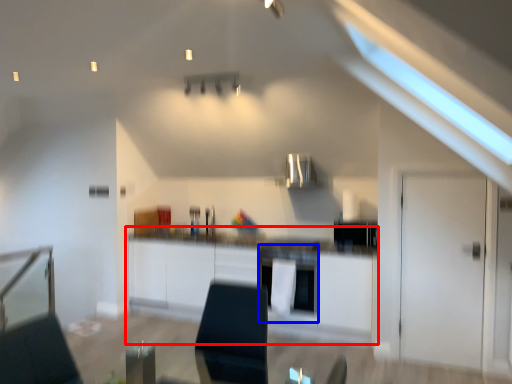
Question: Which object appears closest to the camera in this image, cabinetry (highlighted by a red box) or oven (highlighted by a blue box)?

Choices:
 (A) cabinetry
 (B) oven

Answer: (A)